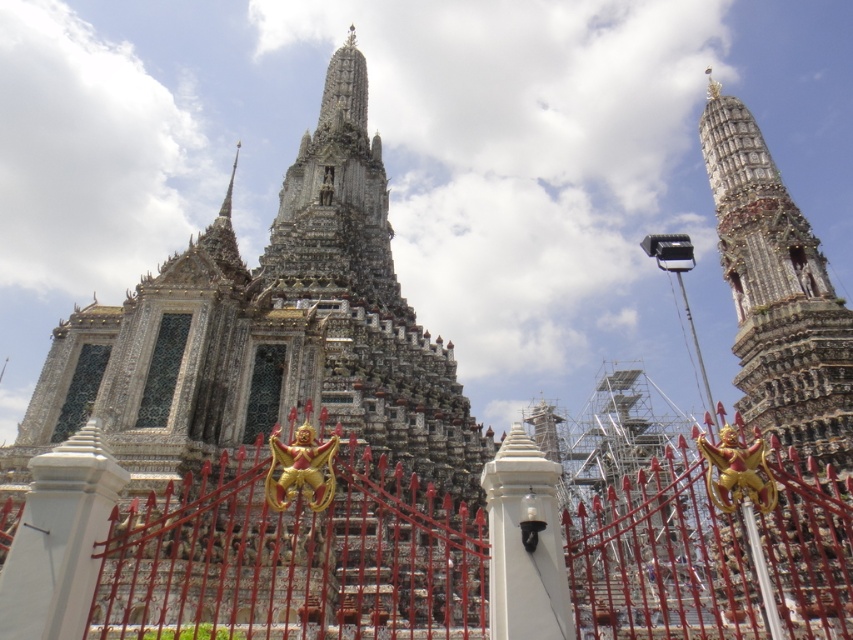
You are a visitor approaching the temple entrance and see the red metal gate at center and the carved stone spire at upper right. Which object appears bigger in your view?

The red metal gate at center appears bigger in your view because it has a larger size compared to the carved stone spire at upper right.

You are standing at the entrance of the temple complex and want to take a photo of the pagoda. The pagoda is located at point (84, 474). If you are currently 146.77 feet away from the pagoda, is the pagoda within your camera lens range? The camera has a maximum zoom range of 150 feet.

The distance from the viewer to point (84, 474) is 146.77 feet, which is within the camera lens range of 150 feet. Therefore, the pagoda at point (84, 474) can be captured within the camera lens range.